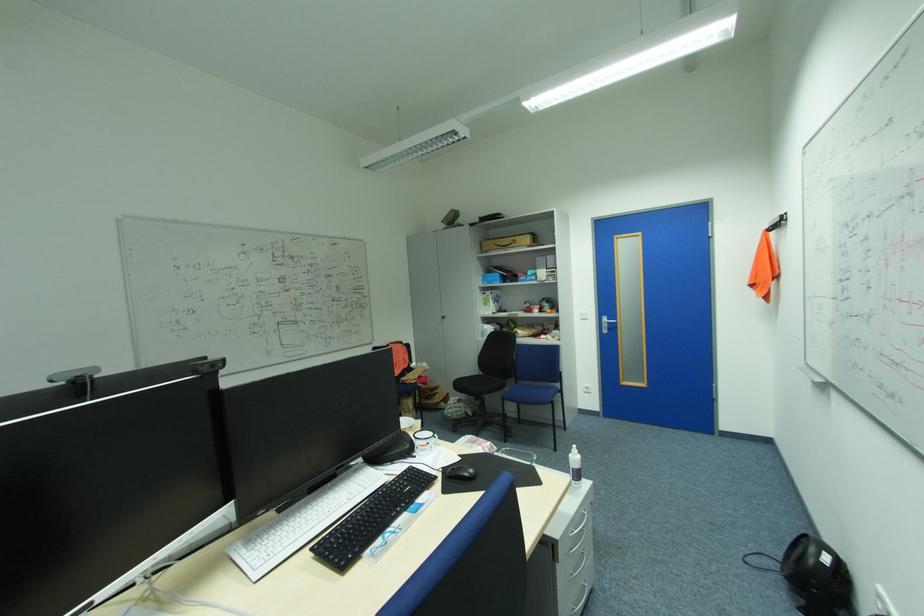
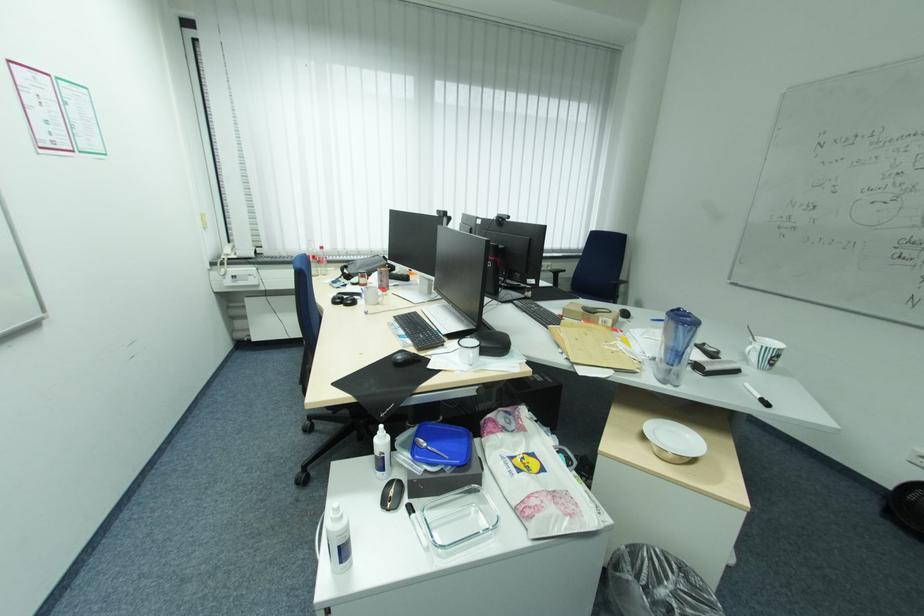
The point at (181, 265) is marked in the first image. Where is the corresponding point in the second image?

(827, 144)